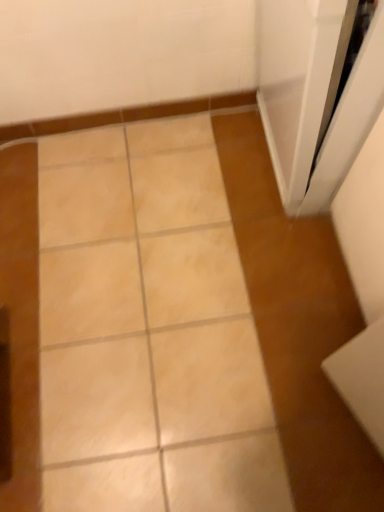
This screenshot has width=384, height=512. What are the coordinates of `white glossy screen door at upper right` in the screenshot? It's located at (349, 120).

What do you see at coordinates (349, 120) in the screenshot? I see `white glossy screen door at upper right` at bounding box center [349, 120].

Find the location of a particular element. beige glossy tile at center is located at coordinates (148, 329).

This screenshot has height=512, width=384. What do you see at coordinates (148, 329) in the screenshot?
I see `beige glossy tile at center` at bounding box center [148, 329].

Identify the location of white glossy screen door at upper right. The image size is (384, 512). (349, 120).

Considering the relative positions of white glossy screen door at upper right and beige glossy tile at center in the image provided, is white glossy screen door at upper right to the left of beige glossy tile at center from the viewer's perspective?

No, white glossy screen door at upper right is not to the left of beige glossy tile at center.

Which object is further away from the camera taking this photo, white glossy screen door at upper right or beige glossy tile at center?

beige glossy tile at center is more distant.

Which point is more distant from viewer, (342, 160) or (65, 503)?

Positioned behind is point (342, 160).

From the image's perspective, is white glossy screen door at upper right above or below beige glossy tile at center?

From the image's perspective, white glossy screen door at upper right appears above beige glossy tile at center.

From a real-world perspective, is white glossy screen door at upper right located beneath beige glossy tile at center?

No, from a real-world perspective, white glossy screen door at upper right is not beneath beige glossy tile at center.

Considering the sizes of objects white glossy screen door at upper right and beige glossy tile at center in the image provided, who is wider, white glossy screen door at upper right or beige glossy tile at center?

Wider between the two is beige glossy tile at center.

From their relative heights in the image, would you say white glossy screen door at upper right is taller or shorter than beige glossy tile at center?

white glossy screen door at upper right is taller than beige glossy tile at center.

Considering the sizes of objects white glossy screen door at upper right and beige glossy tile at center in the image provided, who is smaller, white glossy screen door at upper right or beige glossy tile at center?

With smaller size is beige glossy tile at center.

Can we say white glossy screen door at upper right lies outside beige glossy tile at center?

Yes, white glossy screen door at upper right is outside of beige glossy tile at center.

Is white glossy screen door at upper right positioned far away from beige glossy tile at center?

white glossy screen door at upper right is near beige glossy tile at center, not far away.

Looking at this image, is white glossy screen door at upper right looking in the opposite direction of beige glossy tile at center?

No, white glossy screen door at upper right is not facing away from beige glossy tile at center.

At what (x,y) coordinates should I click in order to perform the action: click on screen door above the beige glossy tile at center (from a real-world perspective). Please return your answer as a coordinate pair (x, y). The image size is (384, 512). Looking at the image, I should click on (349, 120).

Is beige glossy tile at center to the left of white glossy screen door at upper right from the viewer's perspective?

Correct, you'll find beige glossy tile at center to the left of white glossy screen door at upper right.

Is the depth of beige glossy tile at center greater than that of white glossy screen door at upper right?

Yes, it is.

Which is closer, (44,357) or (356,89)?

The point (356,89) is more forward.

From the image's perspective, which one is positioned higher, beige glossy tile at center or white glossy screen door at upper right?

From the image's view, white glossy screen door at upper right is above.

From a real-world perspective, does beige glossy tile at center stand above white glossy screen door at upper right?

No, from a real-world perspective, beige glossy tile at center is not over white glossy screen door at upper right

Which object is wider, beige glossy tile at center or white glossy screen door at upper right?

beige glossy tile at center.

Looking at this image, is beige glossy tile at center taller than white glossy screen door at upper right?

Incorrect, the height of beige glossy tile at center is not larger of that of white glossy screen door at upper right.

Considering the relative sizes of beige glossy tile at center and white glossy screen door at upper right in the image provided, is beige glossy tile at center bigger than white glossy screen door at upper right?

No.

Would you say beige glossy tile at center contains white glossy screen door at upper right?

No, white glossy screen door at upper right is not inside beige glossy tile at center.

Is there a large distance between beige glossy tile at center and white glossy screen door at upper right?

That's not correct — beige glossy tile at center is a little close to white glossy screen door at upper right.

Is beige glossy tile at center looking in the opposite direction of white glossy screen door at upper right?

No, beige glossy tile at center's orientation is not away from white glossy screen door at upper right.

How many degrees apart are the facing directions of beige glossy tile at center and white glossy screen door at upper right?

The angle between the facing direction of beige glossy tile at center and the facing direction of white glossy screen door at upper right is 91.3 degrees.

How much distance is there between beige glossy tile at center and white glossy screen door at upper right?

A distance of 24.55 inches exists between beige glossy tile at center and white glossy screen door at upper right.

Where is `screen door lying above the beige glossy tile at center (from the image's perspective)`? This screenshot has width=384, height=512. screen door lying above the beige glossy tile at center (from the image's perspective) is located at coordinates (349, 120).

Where is `screen door on the right of beige glossy tile at center`? The height and width of the screenshot is (512, 384). screen door on the right of beige glossy tile at center is located at coordinates (349, 120).

Locate an element on the screen. This screenshot has height=512, width=384. ceramic tile behind the white glossy screen door at upper right is located at coordinates (148, 329).